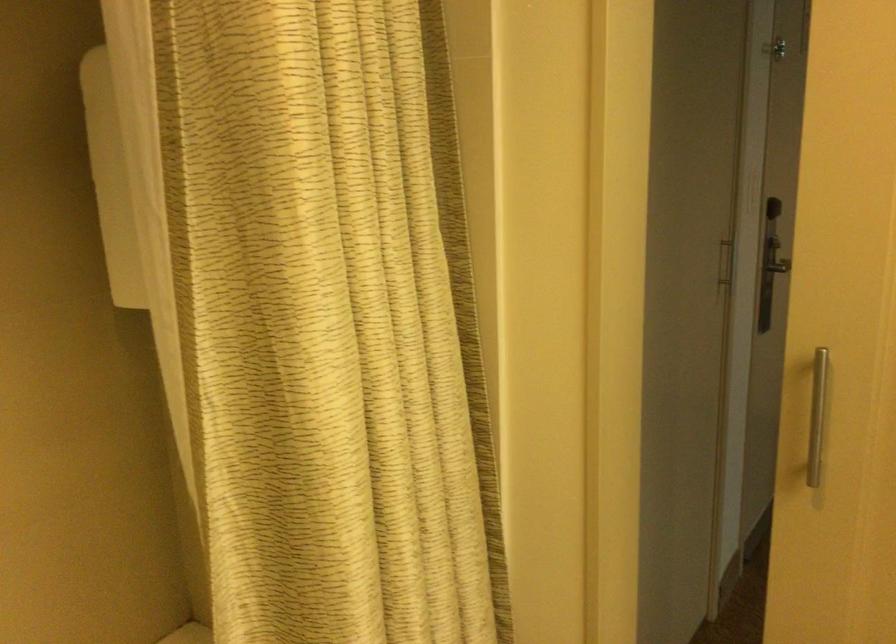
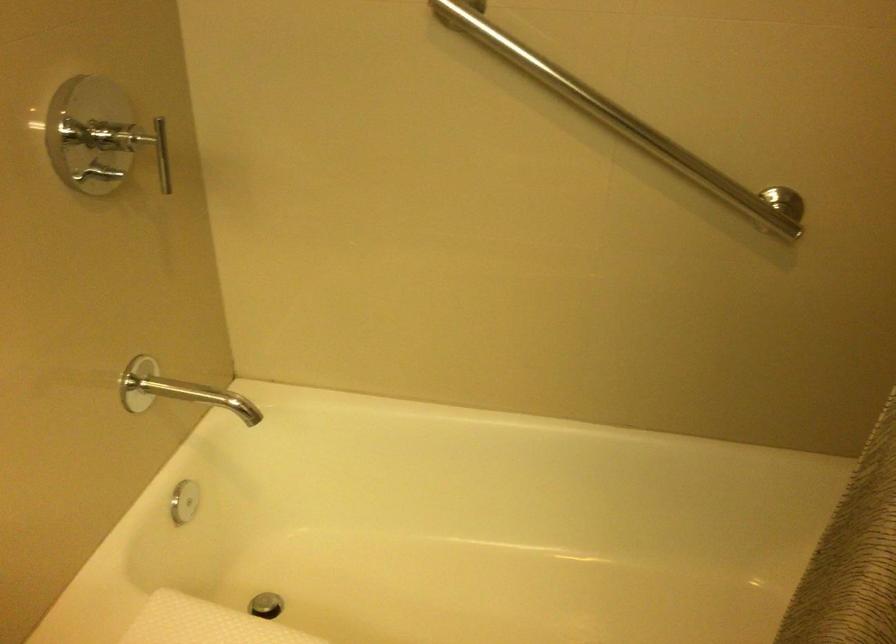
First-person continuous shooting, in which direction is the camera rotating?

The rotation direction of the camera is left-down.